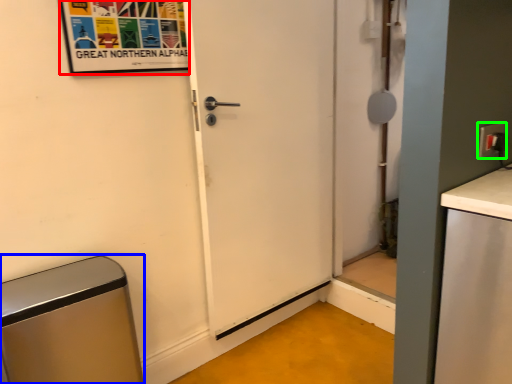
Question: Estimate the real-world distances between objects in this image. Which object is closer to poster (highlighted by a red box), appliance (highlighted by a blue box) or electric outlet (highlighted by a green box)?

Choices:
 (A) appliance
 (B) electric outlet

Answer: (A)